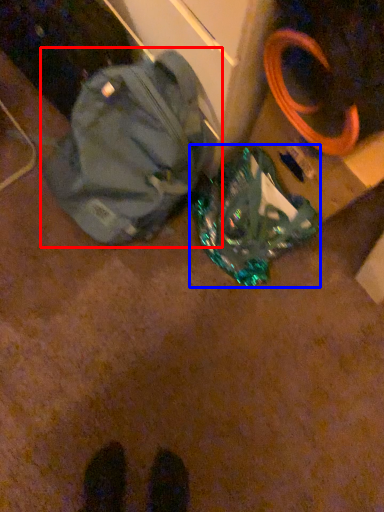
Question: Which point is further to the camera, backpack (highlighted by a red box) or luggage and bags (highlighted by a blue box)?

Choices:
 (A) backpack
 (B) luggage and bags

Answer: (B)